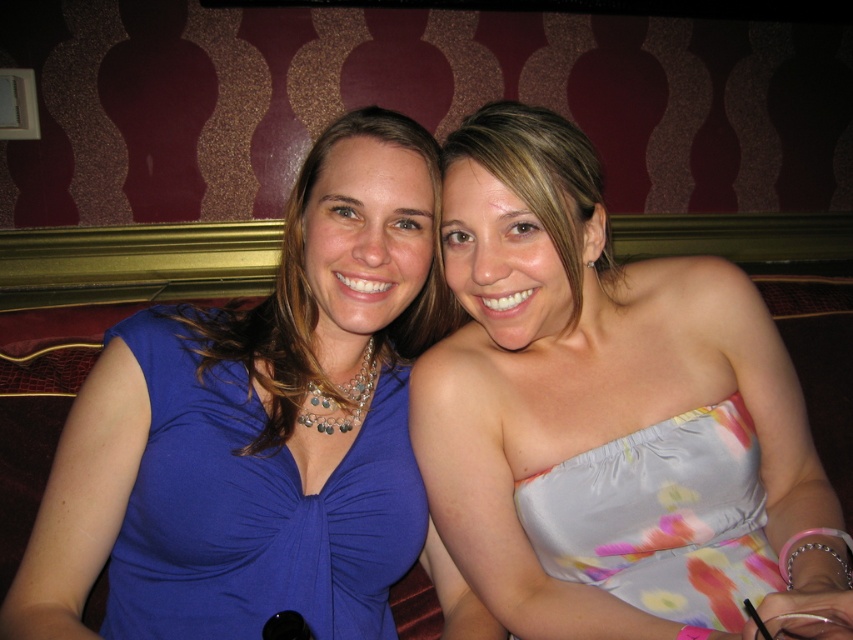
In the scene shown: Is silky floral dress at center thinner than matte blue dress at left?

No.

Which is behind, point (503, 312) or point (351, 525)?

The point (351, 525) is more distant.

This screenshot has height=640, width=853. Describe the element at coordinates (604, 410) in the screenshot. I see `silky floral dress at center` at that location.

Locate an element on the screen. The height and width of the screenshot is (640, 853). silky floral dress at center is located at coordinates [604, 410].

Where is `matte blue dress at left`? matte blue dress at left is located at coordinates (254, 508).

Can you confirm if matte blue dress at left is wider than floral satin dress at center?

Indeed, matte blue dress at left has a greater width compared to floral satin dress at center.

Where is `matte blue dress at left`? matte blue dress at left is located at coordinates (254, 508).

Is matte blue dress at left further to camera compared to matte blue dress at center?

No.

Who is more distant from viewer, (276, 532) or (293, 275)?

Point (293, 275)

This screenshot has height=640, width=853. Find the location of `matte blue dress at left`. matte blue dress at left is located at coordinates (254, 508).